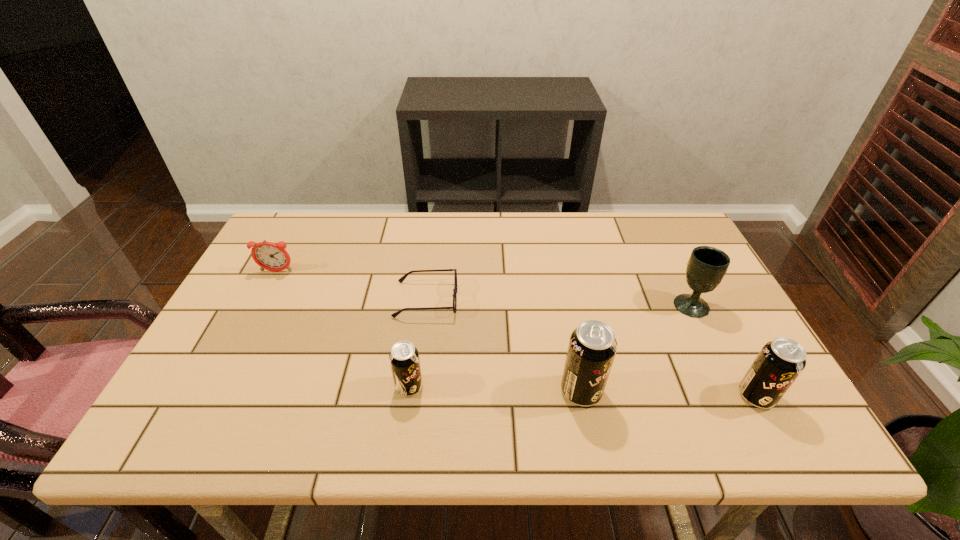
Where is `free space located 0.130m on the left of the second tallest soda can`? The height and width of the screenshot is (540, 960). free space located 0.130m on the left of the second tallest soda can is located at coordinates (680, 396).

Locate an element on the screen. The image size is (960, 540). blank area located on the front-facing side of the shortest object is located at coordinates (586, 300).

Where is `free space located 0.190m on the front of the chalice`? Image resolution: width=960 pixels, height=540 pixels. free space located 0.190m on the front of the chalice is located at coordinates (729, 380).

Image resolution: width=960 pixels, height=540 pixels. In order to click on free space located 0.120m on the front-facing side of the alarm clock in this screenshot , I will do `click(260, 304)`.

Locate an element on the screen. object that is at the left edge is located at coordinates (270, 256).

The width and height of the screenshot is (960, 540). What are the coordinates of `soda can that is at the right edge` in the screenshot? It's located at (779, 363).

At what (x,y) coordinates should I click in order to perform the action: click on chalice situated at the right edge. Please return your answer as a coordinate pair (x, y). Looking at the image, I should click on (706, 267).

The image size is (960, 540). In order to click on object that is at the near right corner in this screenshot , I will do `click(779, 363)`.

The image size is (960, 540). I want to click on vacant space at the far edge, so click(468, 218).

You are a GUI agent. You are given a task and a screenshot of the screen. Output one action in this format:
    pyautogui.click(x=<x>, y=<y>)
    Task: Click on the vacant space at the near edge of the desktop
    This screenshot has width=960, height=540.
    Given the screenshot: What is the action you would take?
    pyautogui.click(x=415, y=406)